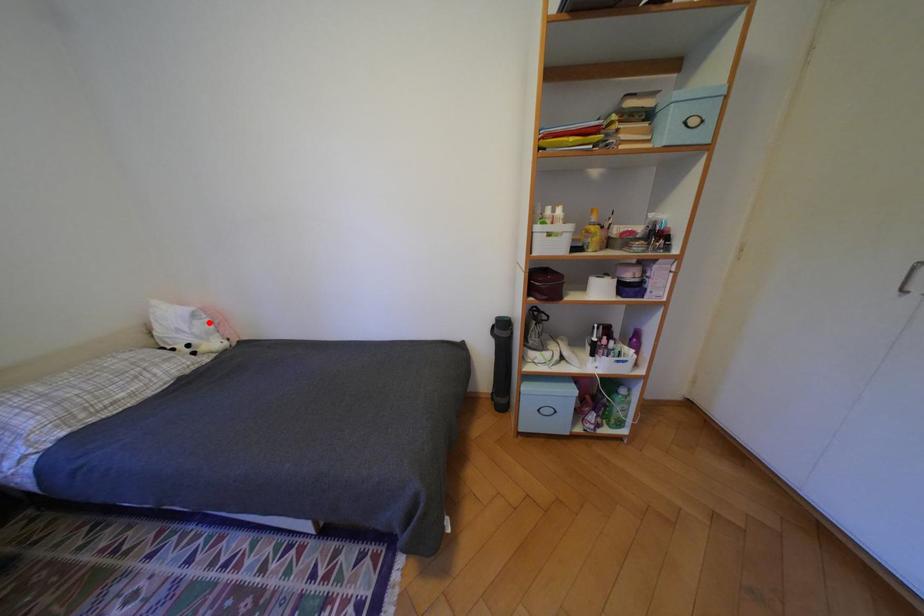
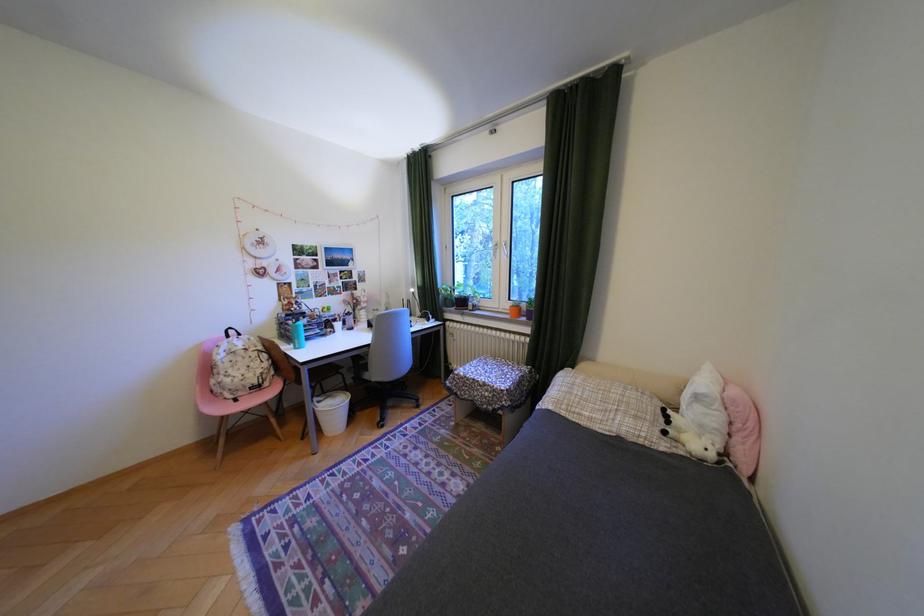
Question: I am providing you with two images of the same scene from different viewpoints. Image1 has a red point marked. In image2, the corresponding 3D location appears at what relative position? Reply with the corresponding letter.

Choices:
 (A) Closer
 (B) Farther

Answer: (B)